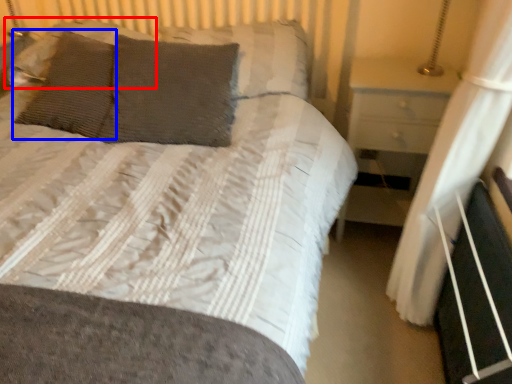
Question: Which object is closer to the camera taking this photo, pillow (highlighted by a red box) or pillow (highlighted by a blue box)?

Choices:
 (A) pillow
 (B) pillow

Answer: (B)